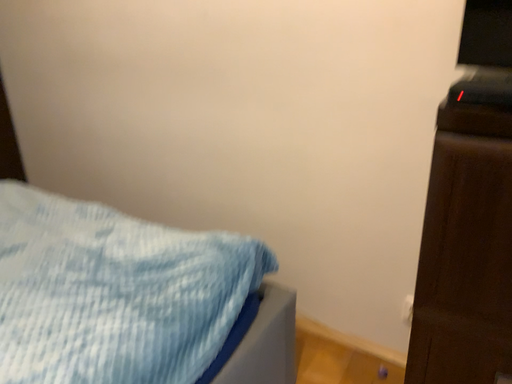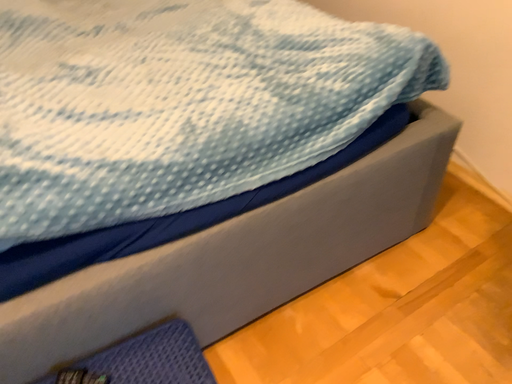
Question: How did the camera likely rotate when shooting the video?

Choices:
 (A) rotated downward
 (B) rotated upward

Answer: (A)